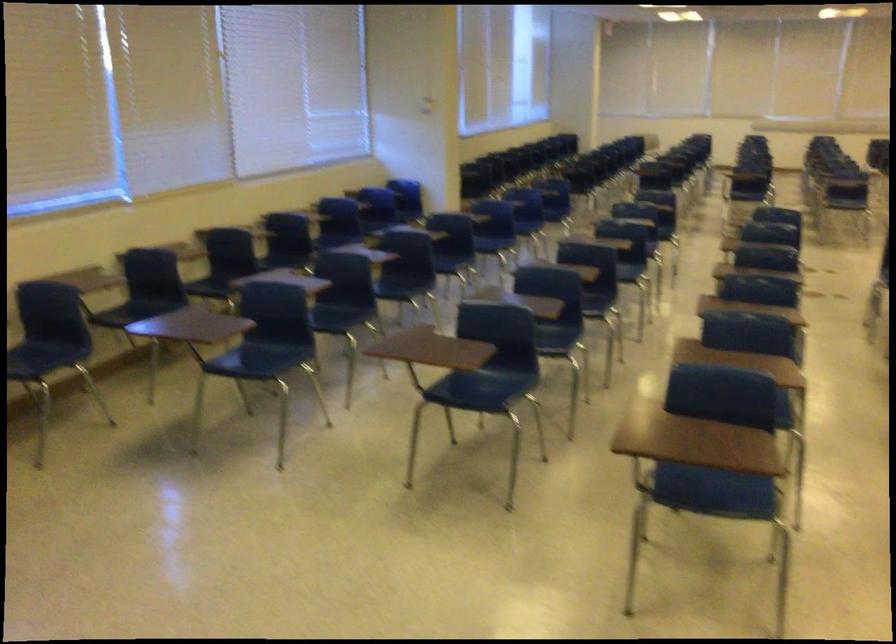
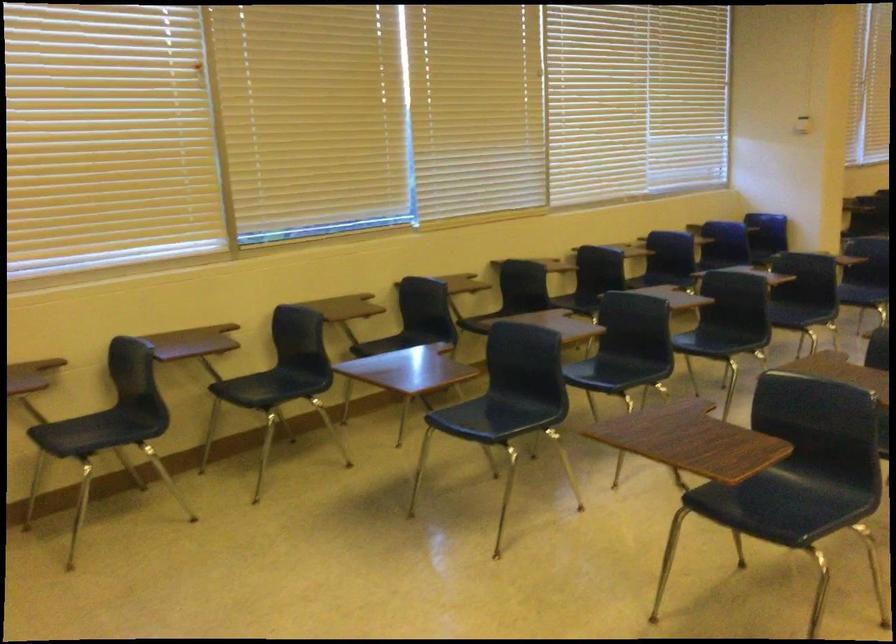
Question: In a continuous first-person perspective shot, in which direction is the camera moving?

Choices:
 (A) Left
 (B) Right
 (C) Forward
 (D) Backward

Answer: (C)